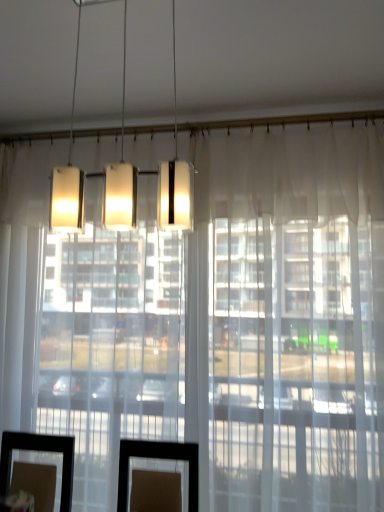
Locate an element on the screen. This screenshot has height=512, width=384. matte white rectangular light fixture at upper center is located at coordinates (147, 174).

Is matte white rectangular light fixture at upper center smaller than transparent glass door at center, which appears as the 1th glass door when viewed from the right?

Yes.

Between point (71, 176) and point (374, 250), which one is positioned in front?

Point (374, 250)

Is transparent glass door at center, which is the second glass door from right to left, next to matte white rectangular light fixture at upper center?

No, transparent glass door at center, which is the second glass door from right to left, is not next to matte white rectangular light fixture at upper center.

Does transparent glass door at center, the first glass door from the left, have a lesser width compared to matte white rectangular light fixture at upper center?

No.

From the image's perspective, between transparent glass door at center, which is the second glass door from right to left, and matte white rectangular light fixture at upper center, which one is located above?

From the image's view, matte white rectangular light fixture at upper center is above.

Can you tell me how much transparent glass door at center, arranged as the 2th glass door when viewed from the left, and matte white rectangular light fixture at upper center differ in facing direction?

179 degrees.

Does transparent glass door at center, which appears as the 1th glass door when viewed from the right, have a lesser width compared to matte white rectangular light fixture at upper center?

Incorrect, the width of transparent glass door at center, which appears as the 1th glass door when viewed from the right, is not less than that of matte white rectangular light fixture at upper center.

Is the depth of transparent glass door at center, arranged as the 2th glass door when viewed from the left, greater than that of matte white rectangular light fixture at upper center?

Yes, the depth of transparent glass door at center, arranged as the 2th glass door when viewed from the left, is greater than that of matte white rectangular light fixture at upper center.

Who is bigger, transparent glass door at center, arranged as the 2th glass door when viewed from the left, or matte white rectangular light fixture at upper center?

Bigger between the two is transparent glass door at center, arranged as the 2th glass door when viewed from the left.

Does transparent glass door at center, which is the second glass door from right to left, have a greater width compared to transparent glass door at center, arranged as the 2th glass door when viewed from the left?

In fact, transparent glass door at center, which is the second glass door from right to left, might be narrower than transparent glass door at center, arranged as the 2th glass door when viewed from the left.

Considering the relative sizes of transparent glass door at center, the first glass door from the left, and transparent glass door at center, arranged as the 2th glass door when viewed from the left, in the image provided, is transparent glass door at center, the first glass door from the left, shorter than transparent glass door at center, arranged as the 2th glass door when viewed from the left,?

Correct, transparent glass door at center, the first glass door from the left, is not as tall as transparent glass door at center, arranged as the 2th glass door when viewed from the left.

Between transparent glass door at center, which is the second glass door from right to left, and transparent glass door at center, arranged as the 2th glass door when viewed from the left, which one is positioned in front?

transparent glass door at center, arranged as the 2th glass door when viewed from the left, is closer to the camera.

Is transparent glass door at center, which is the second glass door from right to left, not inside transparent glass door at center, which appears as the 1th glass door when viewed from the right?

Yes.

Which is behind, transparent glass door at center, which appears as the 1th glass door when viewed from the right, or transparent glass door at center, the first glass door from the left?

transparent glass door at center, the first glass door from the left, is behind.

Is transparent glass door at center, arranged as the 2th glass door when viewed from the left, not close to transparent glass door at center, the first glass door from the left?

They are positioned close to each other.

Which of these two, transparent glass door at center, which appears as the 1th glass door when viewed from the right, or transparent glass door at center, which is the second glass door from right to left, stands shorter?

Standing shorter between the two is transparent glass door at center, which is the second glass door from right to left.

From the image's perspective, is transparent glass door at center, arranged as the 2th glass door when viewed from the left, above or below transparent glass door at center, which is the second glass door from right to left?

Clearly, from the image's perspective, transparent glass door at center, arranged as the 2th glass door when viewed from the left, is below transparent glass door at center, which is the second glass door from right to left.

Is transparent glass door at center, the first glass door from the left, surrounded by matte white rectangular light fixture at upper center?

No, transparent glass door at center, the first glass door from the left, is not inside matte white rectangular light fixture at upper center.

Which object is positioned more to the left, matte white rectangular light fixture at upper center or transparent glass door at center, which is the second glass door from right to left?

From the viewer's perspective, transparent glass door at center, which is the second glass door from right to left, appears more on the left side.

Can you tell me how much matte white rectangular light fixture at upper center and transparent glass door at center, the first glass door from the left, differ in facing direction?

There is a 179-degree angle between the facing directions of matte white rectangular light fixture at upper center and transparent glass door at center, the first glass door from the left.

Considering the sizes of objects matte white rectangular light fixture at upper center and transparent glass door at center, the first glass door from the left, in the image provided, who is thinner, matte white rectangular light fixture at upper center or transparent glass door at center, the first glass door from the left,?

matte white rectangular light fixture at upper center.

The height and width of the screenshot is (512, 384). In order to click on lamp above the transparent glass door at center, arranged as the 2th glass door when viewed from the left (from a real-world perspective) in this screenshot , I will do `click(147, 174)`.

I want to click on lamp that appears above the transparent glass door at center, which is the second glass door from right to left (from the image's perspective), so click(x=147, y=174).

Looking at the image, which one is located further to transparent glass door at center, the first glass door from the left, transparent glass door at center, which appears as the 1th glass door when viewed from the right, or matte white rectangular light fixture at upper center?

matte white rectangular light fixture at upper center.

From the image, which object appears to be farther from transparent glass door at center, the first glass door from the left, matte white rectangular light fixture at upper center or transparent glass door at center, arranged as the 2th glass door when viewed from the left?

Among the two, matte white rectangular light fixture at upper center is located further to transparent glass door at center, the first glass door from the left.

Looking at the image, which one is located closer to matte white rectangular light fixture at upper center, transparent glass door at center, arranged as the 2th glass door when viewed from the left, or transparent glass door at center, the first glass door from the left?

transparent glass door at center, the first glass door from the left.

Which object lies nearer to the anchor point transparent glass door at center, arranged as the 2th glass door when viewed from the left, matte white rectangular light fixture at upper center or transparent glass door at center, which is the second glass door from right to left?

Among the two, transparent glass door at center, which is the second glass door from right to left, is located nearer to transparent glass door at center, arranged as the 2th glass door when viewed from the left.

From the image, which object appears to be nearer to transparent glass door at center, arranged as the 2th glass door when viewed from the left, transparent glass door at center, the first glass door from the left, or matte white rectangular light fixture at upper center?

transparent glass door at center, the first glass door from the left, lies closer to transparent glass door at center, arranged as the 2th glass door when viewed from the left, than the other object.

Looking at the image, which one is located closer to matte white rectangular light fixture at upper center, transparent glass door at center, which is the second glass door from right to left, or transparent glass door at center, arranged as the 2th glass door when viewed from the left?

Based on the image, transparent glass door at center, which is the second glass door from right to left, appears to be nearer to matte white rectangular light fixture at upper center.

You are a GUI agent. You are given a task and a screenshot of the screen. Output one action in this format:
    pyautogui.click(x=<x>, y=<y>)
    Task: Click on the lamp between transparent glass door at center, which is the second glass door from right to left, and transparent glass door at center, arranged as the 2th glass door when viewed from the left, from left to right
    The image size is (384, 512).
    Given the screenshot: What is the action you would take?
    point(147,174)